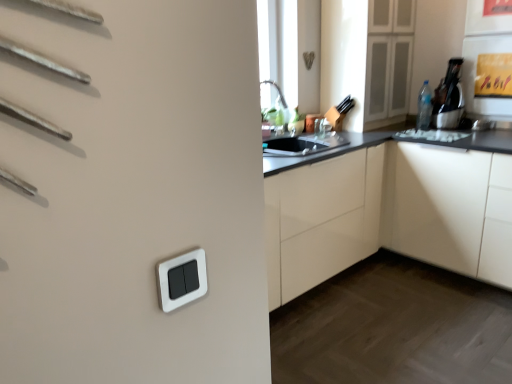
Question: Can you confirm if white glossy cabinet at center, the third cabinetry when ordered from left to right, is shorter than silver metallic faucet at upper center?

Choices:
 (A) yes
 (B) no

Answer: (B)

Question: Is white glossy cabinet at center, the third cabinetry when ordered from left to right, outside of silver metallic faucet at upper center?

Choices:
 (A) yes
 (B) no

Answer: (A)

Question: Is white glossy cabinet at center, the third cabinetry when ordered from left to right, facing towards silver metallic faucet at upper center?

Choices:
 (A) yes
 (B) no

Answer: (B)

Question: Can you see white glossy cabinet at center, the third cabinetry when ordered from left to right, touching silver metallic faucet at upper center?

Choices:
 (A) no
 (B) yes

Answer: (A)

Question: From the image's perspective, is white glossy cabinet at center, the third cabinetry when ordered from left to right, located above silver metallic faucet at upper center?

Choices:
 (A) yes
 (B) no

Answer: (B)

Question: Is clear plastic bottle at upper right in front of or behind white glossy cabinet at upper right, the second cabinetry when ordered from right to left, in the image?

Choices:
 (A) behind
 (B) front

Answer: (A)

Question: Based on their sizes in the image, would you say clear plastic bottle at upper right is bigger or smaller than white glossy cabinet at upper right, the 2th cabinetry positioned from the left?

Choices:
 (A) small
 (B) big

Answer: (A)

Question: Which is correct: clear plastic bottle at upper right is inside white glossy cabinet at upper right, the 2th cabinetry positioned from the left, or outside of it?

Choices:
 (A) outside
 (B) inside

Answer: (A)

Question: Considering the relative positions of clear plastic bottle at upper right and white glossy cabinet at upper right, the 2th cabinetry positioned from the left, in the image provided, is clear plastic bottle at upper right to the left or to the right of white glossy cabinet at upper right, the 2th cabinetry positioned from the left,?

Choices:
 (A) right
 (B) left

Answer: (A)

Question: Is point (325, 221) closer or farther from the camera than point (325, 135)?

Choices:
 (A) closer
 (B) farther

Answer: (A)

Question: In the image, is white glossy cabinet at center, the first cabinetry in the left-to-right sequence, positioned in front of or behind silver metallic faucet at upper center?

Choices:
 (A) front
 (B) behind

Answer: (A)

Question: From the image's perspective, is white glossy cabinet at center, the first cabinetry in the left-to-right sequence, above or below silver metallic faucet at upper center?

Choices:
 (A) below
 (B) above

Answer: (A)

Question: Is white glossy cabinet at center, the third cabinetry when ordered from right to left, spatially inside silver metallic faucet at upper center, or outside of it?

Choices:
 (A) outside
 (B) inside

Answer: (A)

Question: Is silver metallic faucet at upper center wider or thinner than white plastic light switch at center?

Choices:
 (A) wide
 (B) thin

Answer: (A)

Question: Is silver metallic faucet at upper center taller or shorter than white plastic light switch at center?

Choices:
 (A) short
 (B) tall

Answer: (B)